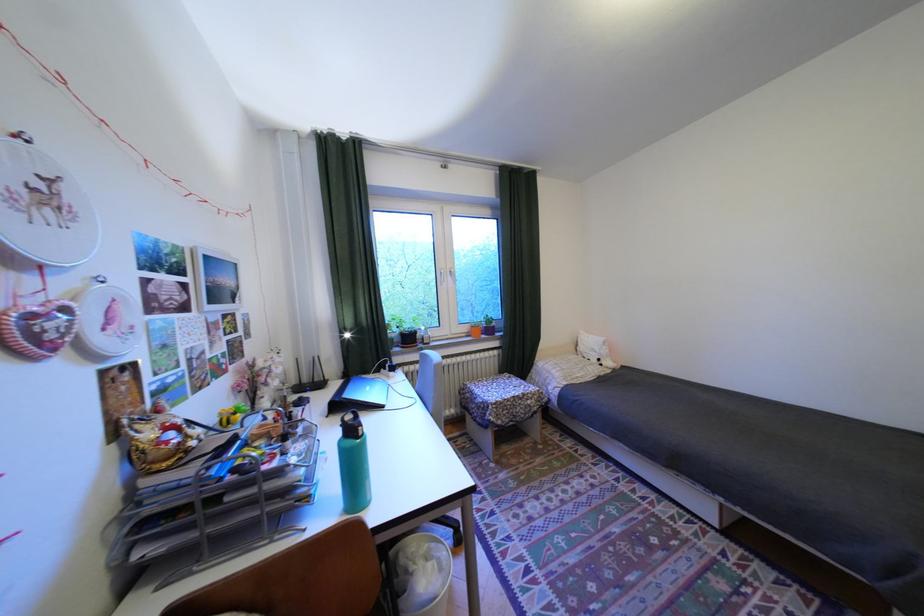
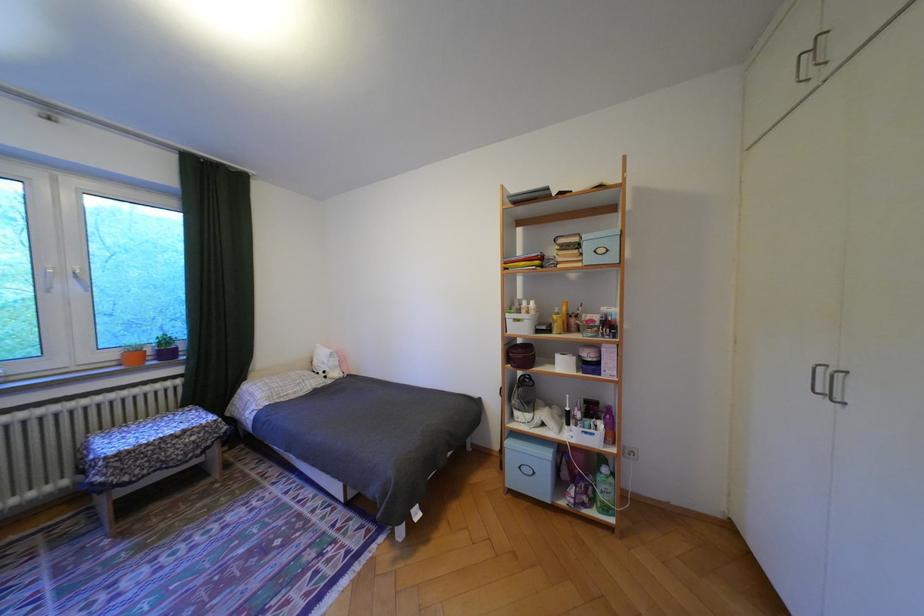
Where in the second image is the point corresponding to the point at 501,331 from the first image?

(178, 354)